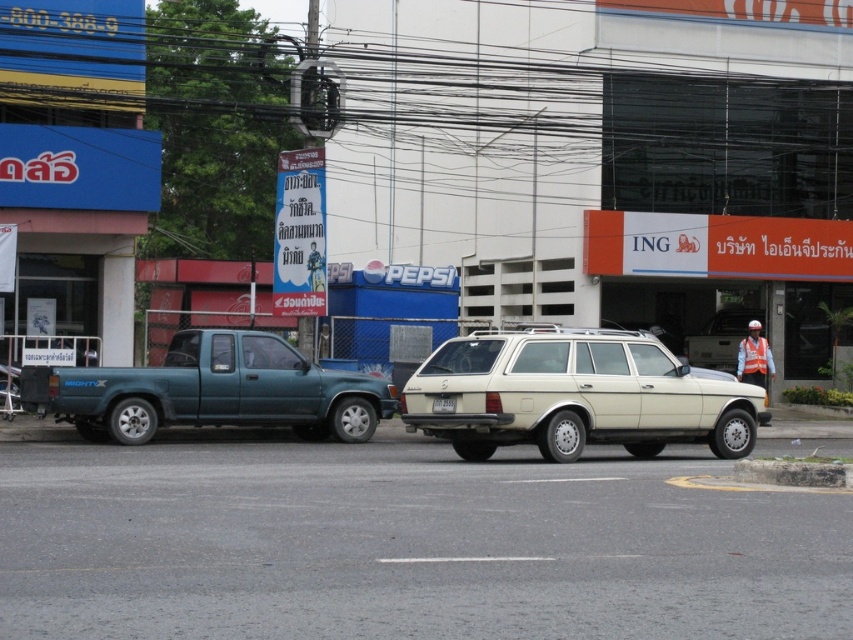
You are a delivery person standing at the point marked by the coordinates point (575, 396). You need to deliver a package to the beige matte station wagon at center. Is the beige matte station wagon at center in your immediate vicinity?

The point (575, 396) corresponds to the beige matte station wagon at center, so yes, the beige matte station wagon at center is in your immediate vicinity as you are standing at that point.

You are a delivery person needing to park your vehicle between the beige matte station wagon at center and the teal matte truck at left. Can you safely park your car there without overlapping either vehicle?

The beige matte station wagon at center is positioned under the teal matte truck at left, meaning they are stacked vertically. Since they are not side by side, there is no space between them to park your vehicle safely without overlapping either vehicle.